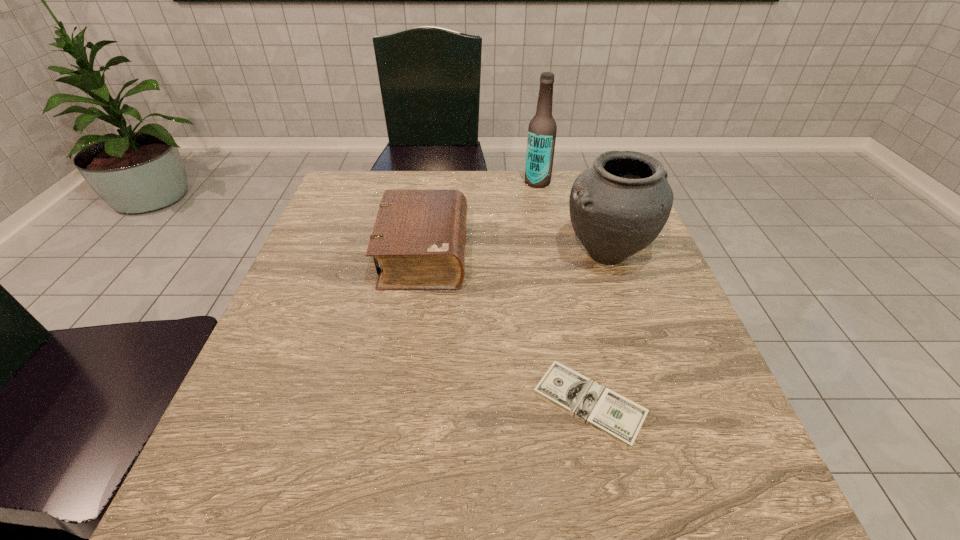
This screenshot has height=540, width=960. I want to click on free space at the near left corner of the desktop, so (218, 476).

Where is `vacant region between the third tallest object and the urn`? The width and height of the screenshot is (960, 540). vacant region between the third tallest object and the urn is located at coordinates (516, 254).

Locate an element on the screen. unoccupied position between the beer bottle and the leftmost object is located at coordinates (481, 218).

You are a GUI agent. You are given a task and a screenshot of the screen. Output one action in this format:
    pyautogui.click(x=<x>, y=<y>)
    Task: Click on the free area in between the dollar and the beer bottle
    
    Given the screenshot: What is the action you would take?
    pyautogui.click(x=564, y=293)

This screenshot has width=960, height=540. In order to click on free point between the third tallest object and the beer bottle in this screenshot , I will do `click(481, 218)`.

In order to click on free point between the leftmost object and the shortest object in this screenshot , I will do `click(507, 329)`.

In order to click on free point between the farthest object and the nearest object in this screenshot , I will do `click(564, 293)`.

Where is `vacant area between the nearest object and the second shortest object`? This screenshot has height=540, width=960. vacant area between the nearest object and the second shortest object is located at coordinates (507, 329).

This screenshot has height=540, width=960. In order to click on vacant space that is in between the dollar and the beer bottle in this screenshot , I will do `click(564, 293)`.

At what (x,y) coordinates should I click in order to perform the action: click on free space between the shortest object and the urn. Please return your answer as a coordinate pair (x, y). This screenshot has width=960, height=540. Looking at the image, I should click on (598, 329).